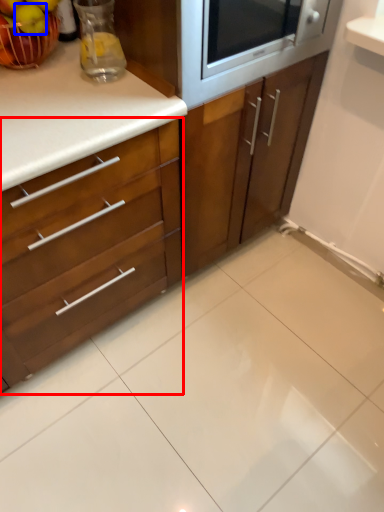
Question: Among these objects, which one is nearest to the camera, cabinetry (highlighted by a red box) or apple (highlighted by a blue box)?

Choices:
 (A) cabinetry
 (B) apple

Answer: (A)